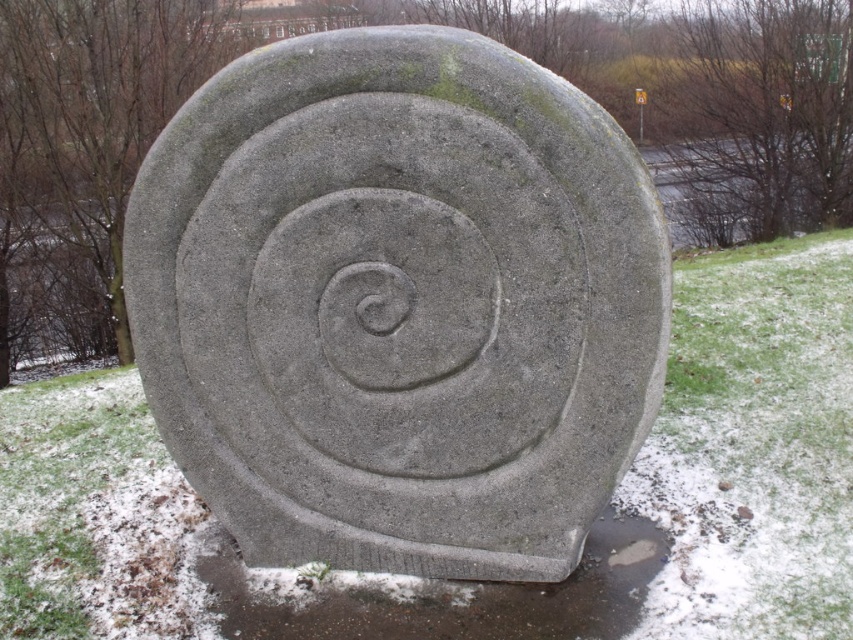
From the picture: Can you confirm if gray concrete spiral at center is bigger than slick concrete puddle at lower center?

Indeed, gray concrete spiral at center has a larger size compared to slick concrete puddle at lower center.

Which is behind, point (498, 577) or point (506, 618)?

The point (498, 577) is behind.

Image resolution: width=853 pixels, height=640 pixels. Find the location of `gray concrete spiral at center`. gray concrete spiral at center is located at coordinates (403, 305).